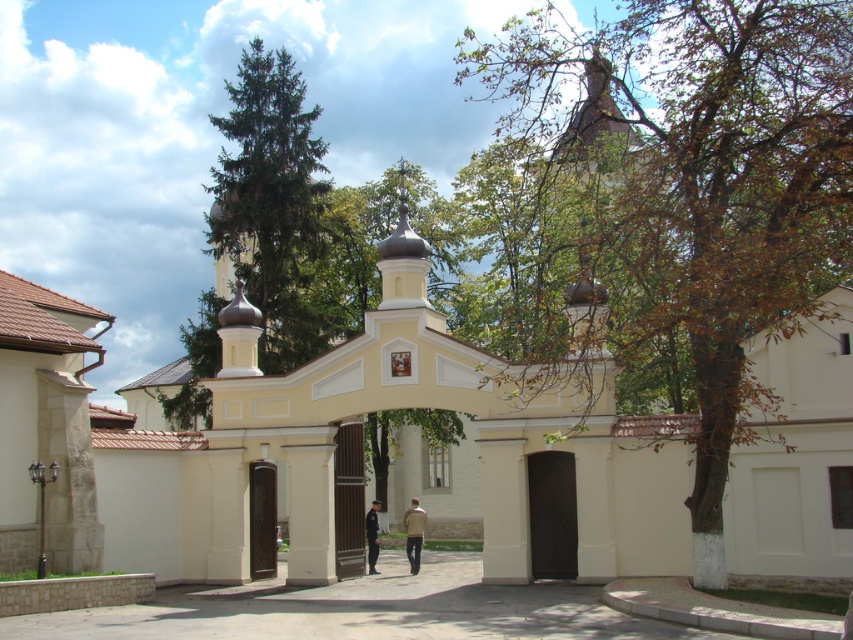
Does beige fabric jacket at center have a lesser height compared to uniformed officer at center?

Incorrect, beige fabric jacket at center's height does not fall short of uniformed officer at center's.

Is point (416, 545) closer to camera compared to point (370, 513)?

Yes.

Which is in front, point (413, 573) or point (376, 516)?

Point (413, 573) is in front.

This screenshot has height=640, width=853. I want to click on beige fabric jacket at center, so click(415, 532).